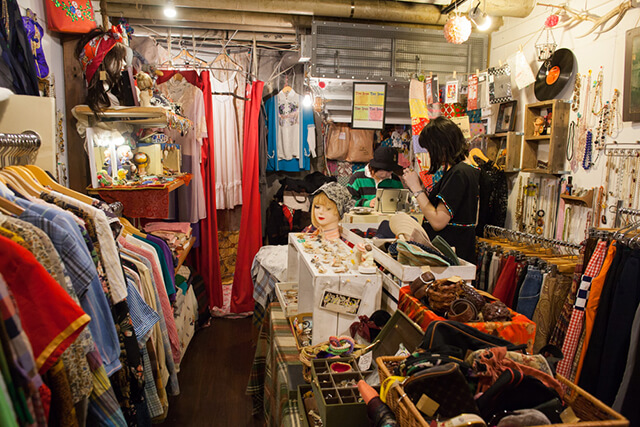
Where is `mannequin`? The image size is (640, 427). mannequin is located at coordinates (326, 220).